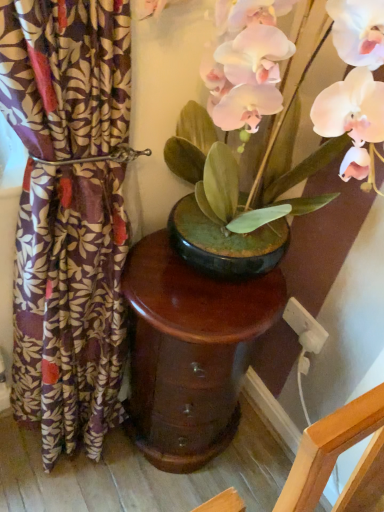
Question: Does glossy wood table at center touch patterned fabric curtain at left?

Choices:
 (A) no
 (B) yes

Answer: (A)

Question: Is glossy wood table at center smaller than patterned fabric curtain at left?

Choices:
 (A) yes
 (B) no

Answer: (A)

Question: Considering the relative sizes of glossy wood table at center and patterned fabric curtain at left in the image provided, is glossy wood table at center wider than patterned fabric curtain at left?

Choices:
 (A) no
 (B) yes

Answer: (B)

Question: From a real-world perspective, is glossy wood table at center beneath patterned fabric curtain at left?

Choices:
 (A) yes
 (B) no

Answer: (A)

Question: Is glossy wood table at center looking in the opposite direction of patterned fabric curtain at left?

Choices:
 (A) yes
 (B) no

Answer: (B)

Question: From the image's perspective, is white plastic electric outlet at lower right located above or below patterned fabric curtain at left?

Choices:
 (A) above
 (B) below

Answer: (B)

Question: Considering the positions of white plastic electric outlet at lower right and patterned fabric curtain at left in the image, is white plastic electric outlet at lower right taller or shorter than patterned fabric curtain at left?

Choices:
 (A) tall
 (B) short

Answer: (B)

Question: Considering the positions of point (307, 350) and point (74, 348), is point (307, 350) closer or farther from the camera than point (74, 348)?

Choices:
 (A) farther
 (B) closer

Answer: (A)

Question: Visually, is white plastic electric outlet at lower right positioned to the left or to the right of patterned fabric curtain at left?

Choices:
 (A) right
 (B) left

Answer: (A)

Question: Does point (94, 218) appear closer or farther from the camera than point (294, 317)?

Choices:
 (A) farther
 (B) closer

Answer: (B)

Question: From the image's perspective, is patterned fabric curtain at left above or below white plastic electric outlet at lower right?

Choices:
 (A) below
 (B) above

Answer: (B)

Question: Choose the correct answer: Is patterned fabric curtain at left inside white plastic electric outlet at lower right or outside it?

Choices:
 (A) outside
 (B) inside

Answer: (A)

Question: Considering the relative positions of patterned fabric curtain at left and white plastic electric outlet at lower right in the image provided, is patterned fabric curtain at left to the left or to the right of white plastic electric outlet at lower right?

Choices:
 (A) right
 (B) left

Answer: (B)

Question: From the image's perspective, is white plastic electric outlet at lower right located above or below matte black pot at center?

Choices:
 (A) below
 (B) above

Answer: (A)

Question: Is white plastic electric outlet at lower right inside the boundaries of matte black pot at center, or outside?

Choices:
 (A) inside
 (B) outside

Answer: (B)